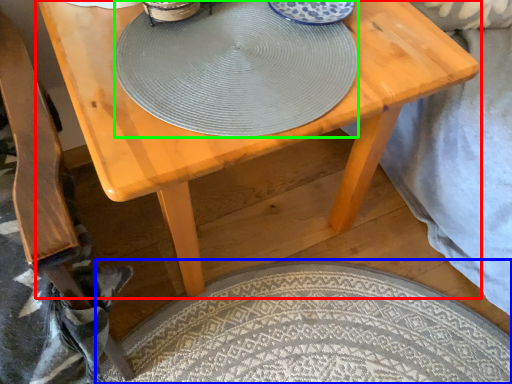
Question: Which object is positioned farthest from table (highlighted by a red box)? Select from mat (highlighted by a blue box) and plate (highlighted by a green box).

Choices:
 (A) mat
 (B) plate

Answer: (A)